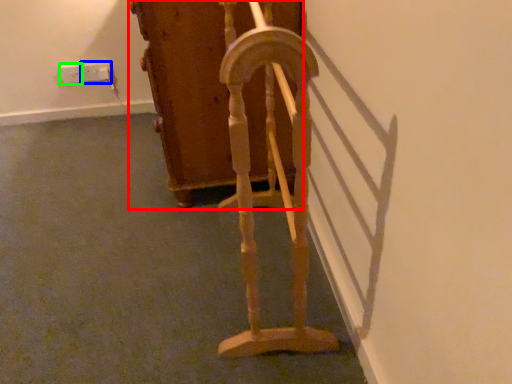
Question: Which object is positioned farthest from furniture (highlighted by a red box)? Select from electric outlet (highlighted by a blue box) and electric outlet (highlighted by a green box).

Choices:
 (A) electric outlet
 (B) electric outlet

Answer: (B)